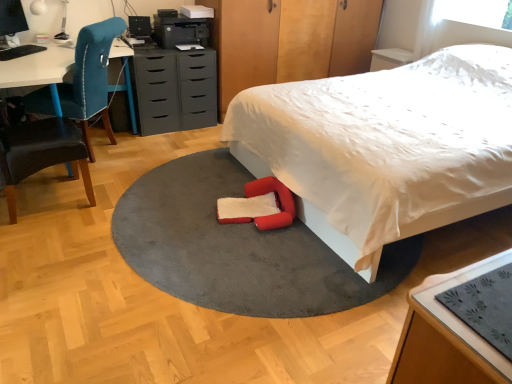
Locate an element on the screen. The height and width of the screenshot is (384, 512). vacant area that is in front of velvet teal chair at left, the 1th chair viewed from the front is located at coordinates (40, 244).